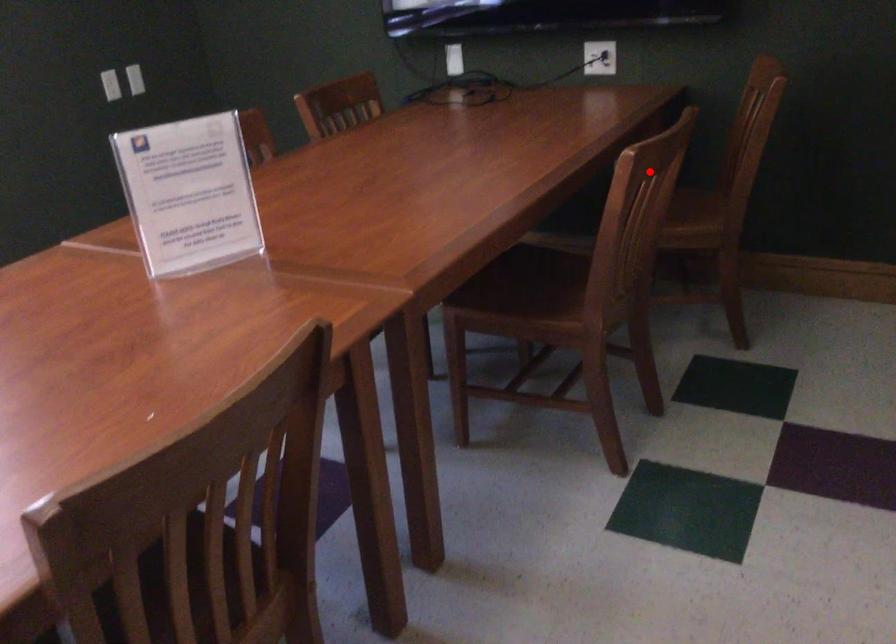
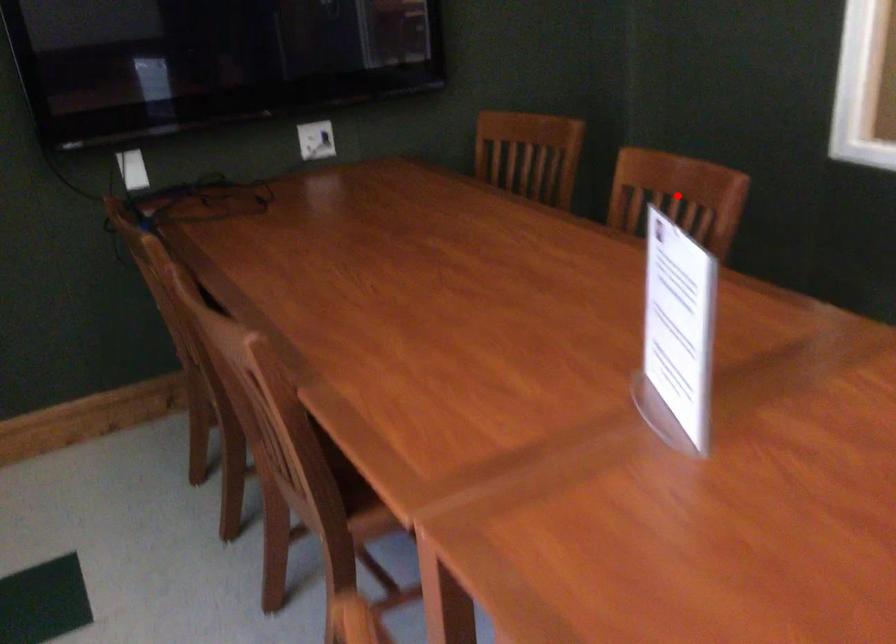
I am providing you with two images of the same scene from different viewpoints. A red point is marked on the first image and another point is marked on the second image. Do the highlighted points in image1 and image2 indicate the same real-world spot?

Yes